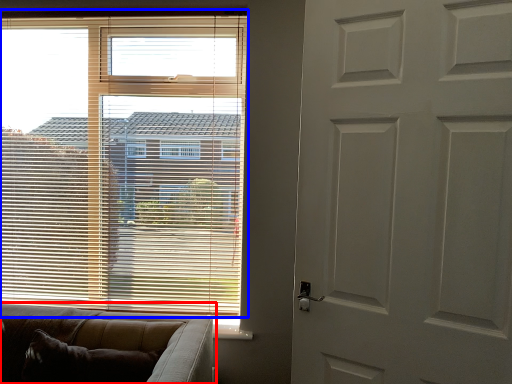
Question: Which object is further to the camera taking this photo, studio couch (highlighted by a red box) or window blind (highlighted by a blue box)?

Choices:
 (A) studio couch
 (B) window blind

Answer: (B)